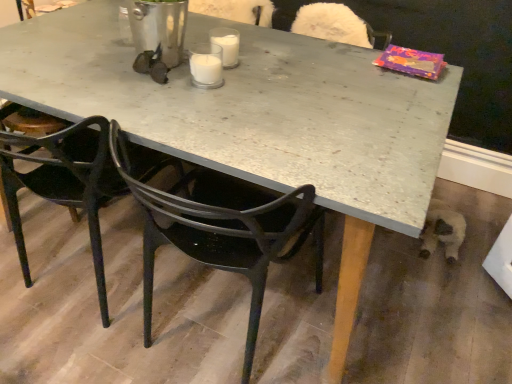
You are a GUI agent. You are given a task and a screenshot of the screen. Output one action in this format:
    pyautogui.click(x=<x>, y=<y>)
    Task: Click on the vacant space to the right of white glass candle at center, which is the first coffee cup in front-to-back order
    This screenshot has height=384, width=512.
    Given the screenshot: What is the action you would take?
    pyautogui.click(x=262, y=79)